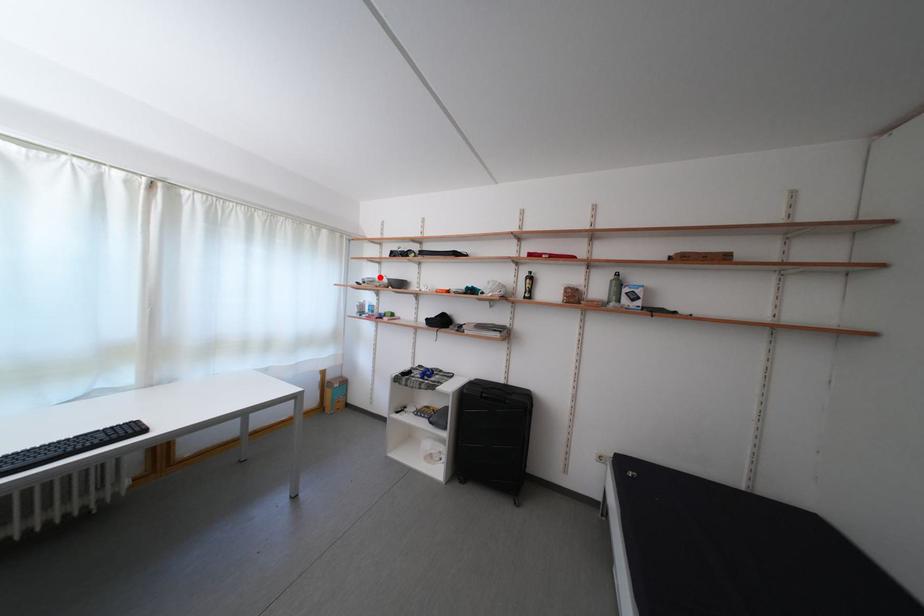
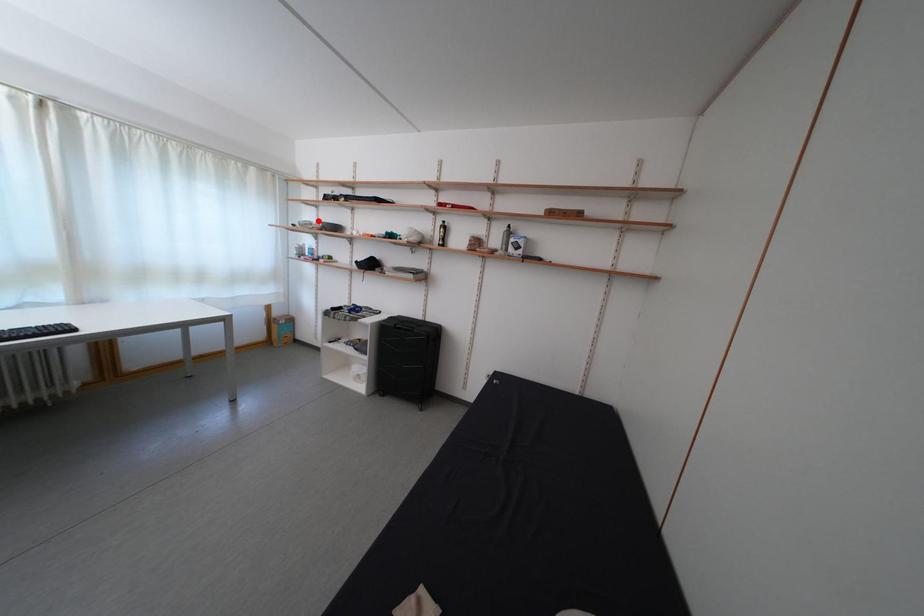
I am providing you with two images of the same scene from different viewpoints. A red point is marked on the first image and another point is marked on the second image. Is the marked point in image1 the same physical position as the marked point in image2?

Yes